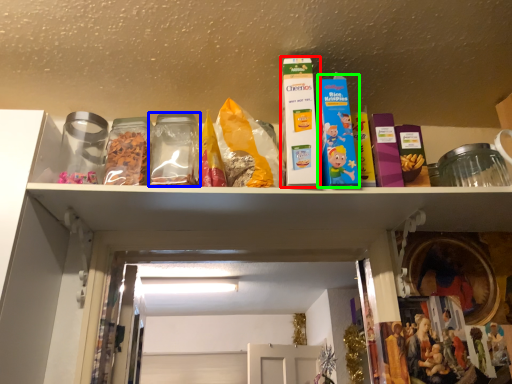
Question: Considering the real-world distances, which object is farthest from product (highlighted by a red box)? glass jar (highlighted by a blue box) or product (highlighted by a green box)?

Choices:
 (A) glass jar
 (B) product

Answer: (A)